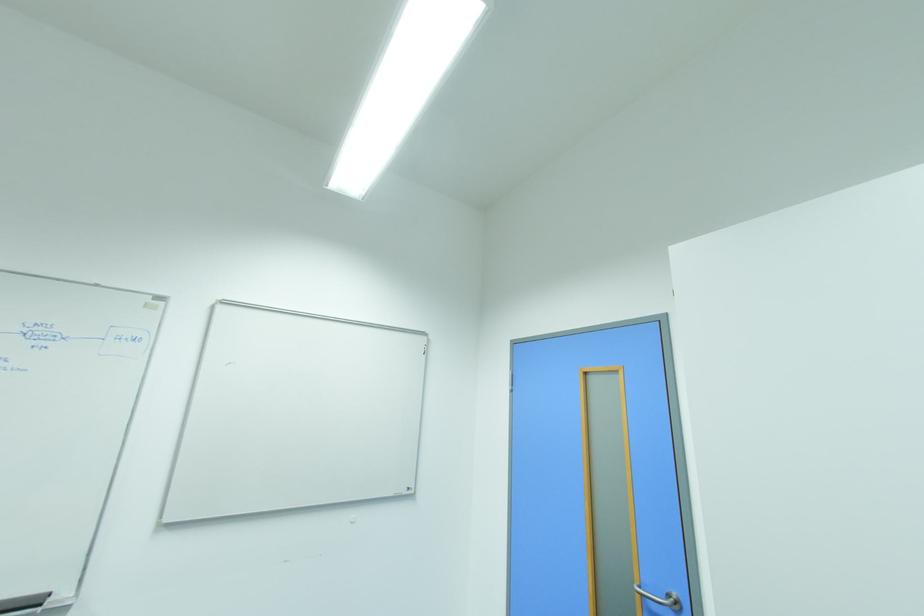
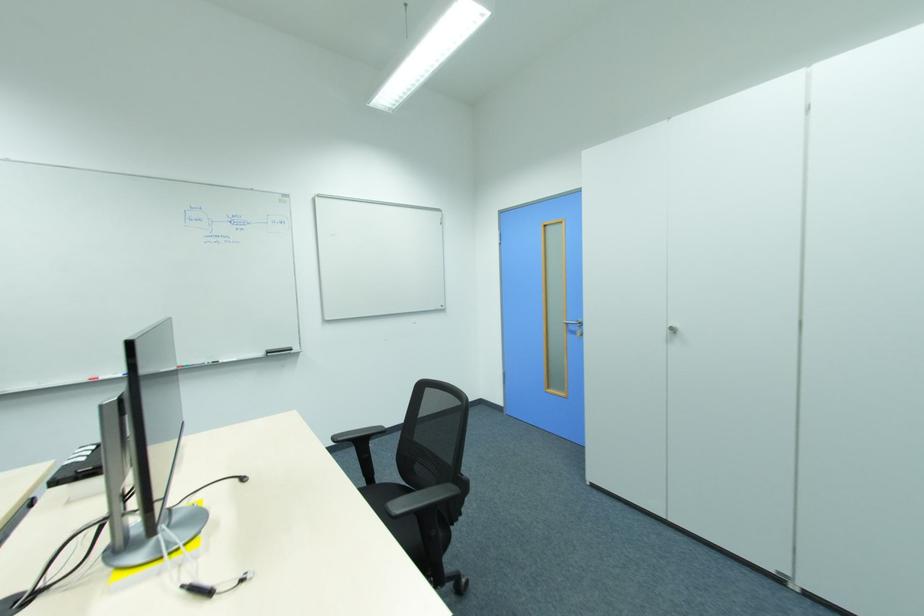
Question: What movement of the cameraman would produce the second image?

Choices:
 (A) Left
 (B) Right
 (C) Forward
 (D) Backward

Answer: (D)